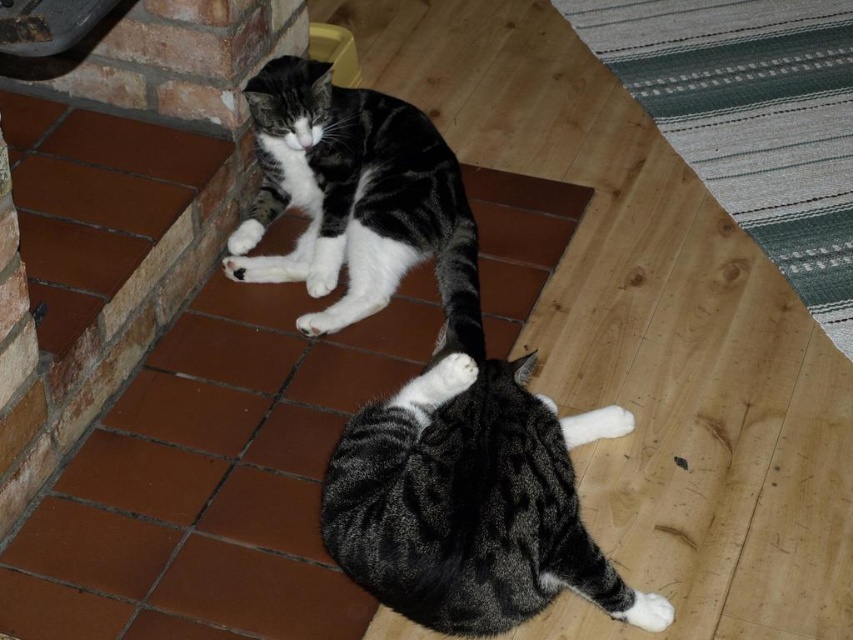
Is white fur paw at lower center shorter than white fur at lower left?

No.

Is point (329, 260) closer to viewer compared to point (242, 227)?

Yes, it is in front of point (242, 227).

Image resolution: width=853 pixels, height=640 pixels. Find the location of `white fur paw at lower center`. white fur paw at lower center is located at coordinates (322, 275).

Which is below, soft fur cat at lower right or white fur at lower center?

Positioned lower is soft fur cat at lower right.

Is soft fur cat at lower right positioned in front of white fur at lower center?

Yes.

This screenshot has width=853, height=640. Describe the element at coordinates (466, 499) in the screenshot. I see `soft fur cat at lower right` at that location.

Where is `soft fur cat at lower right`? The width and height of the screenshot is (853, 640). soft fur cat at lower right is located at coordinates (466, 499).

Is black and white fur cat at upper left positioned at the back of white fur at lower center?

No, black and white fur cat at upper left is in front of white fur at lower center.

Consider the image. Is black and white fur cat at upper left thinner than white fur at lower center?

In fact, black and white fur cat at upper left might be wider than white fur at lower center.

You are a GUI agent. You are given a task and a screenshot of the screen. Output one action in this format:
    pyautogui.click(x=<x>, y=<y>)
    Task: Click on the black and white fur cat at upper left
    
    Given the screenshot: What is the action you would take?
    pyautogui.click(x=360, y=193)